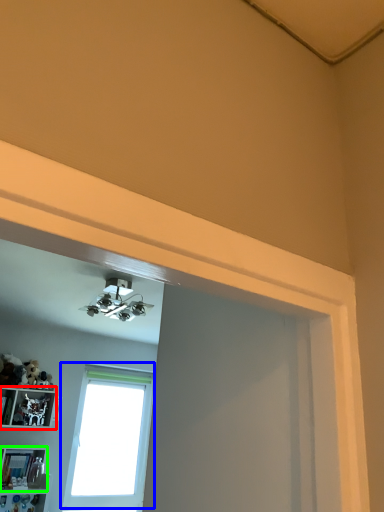
Question: Considering the real-world distances, which object is closest to shelf (highlighted by a red box)? window (highlighted by a blue box) or shelf (highlighted by a green box).

Choices:
 (A) window
 (B) shelf

Answer: (B)